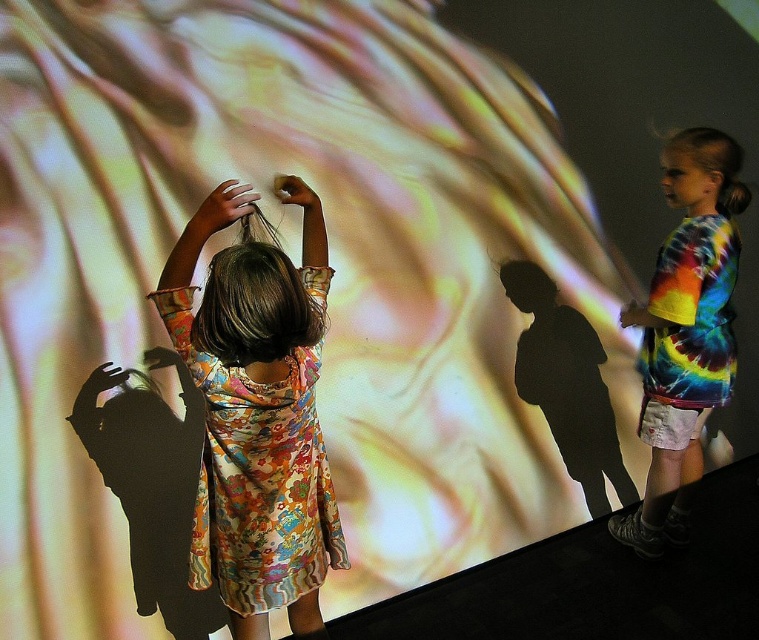
You are a photographer setting up a shoot in this scene. You want to ensure that both the floral dress at center and the matte skin hand at center are clearly visible in your photo. Based on their positions, which object should you focus on first to ensure sharpness?

The floral dress at center is below matte skin hand at center, so you should focus on the matte skin hand at center first to ensure it remains sharp, as it is closer to the camera.

You are a photographer setting up a camera at point 0.5, 0.5. You want to focus on the floral dress at center. Which direction should you move the camera to get the dress into the frame?

The floral dress at center is located at point [257,426]. Since the camera is at [379,320], you should move the camera to the right and slightly upward to align with the floral dress at center.